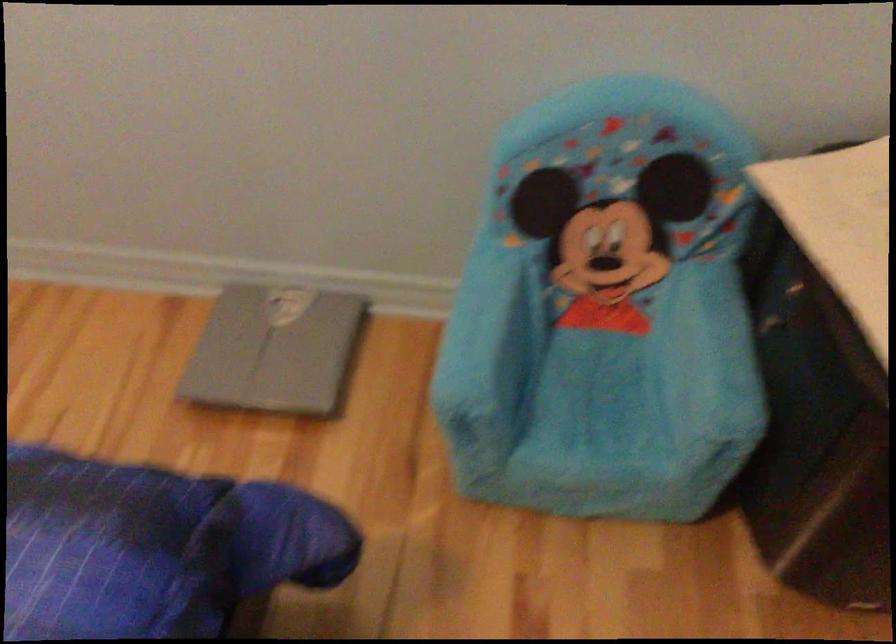
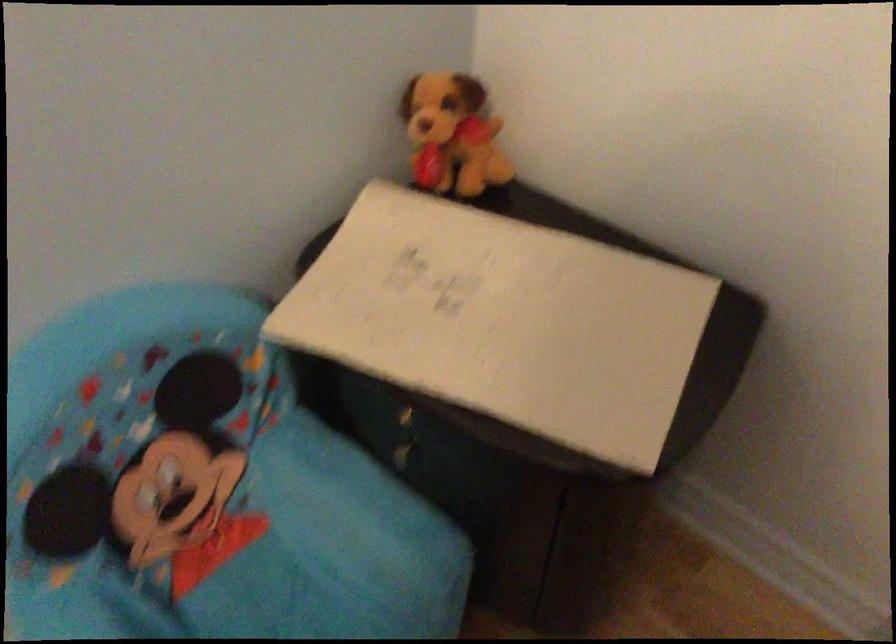
Question: The images are taken continuously from a first-person perspective. In which direction is your viewpoint rotating?

Choices:
 (A) Left
 (B) Right
 (C) Up
 (D) Down

Answer: (B)